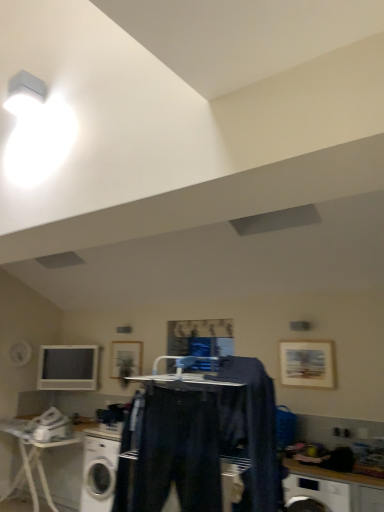
Question: From a real-world perspective, is white glossy washing machine at lower left located beneath dark blue fabric at center, the first clothing positioned from the right?

Choices:
 (A) yes
 (B) no

Answer: (A)

Question: Is white glossy washing machine at lower left further to the viewer compared to dark blue fabric at center, the second clothing from the left?

Choices:
 (A) yes
 (B) no

Answer: (A)

Question: Considering the relative sizes of white glossy washing machine at lower left and dark blue fabric at center, the second clothing from the left, in the image provided, is white glossy washing machine at lower left smaller than dark blue fabric at center, the second clothing from the left,?

Choices:
 (A) no
 (B) yes

Answer: (A)

Question: Is white glossy washing machine at lower left located outside dark blue fabric at center, the second clothing from the left?

Choices:
 (A) yes
 (B) no

Answer: (A)

Question: Is white glossy washing machine at lower left far away from dark blue fabric at center, the first clothing positioned from the right?

Choices:
 (A) no
 (B) yes

Answer: (A)

Question: Can you confirm if white glossy washing machine at lower left is positioned to the left of dark blue fabric at center, the second clothing from the left?

Choices:
 (A) no
 (B) yes

Answer: (B)

Question: Does white glossy computer monitor at left have a greater height compared to wooden framed picture at center, the second picture frame viewed from the right?

Choices:
 (A) no
 (B) yes

Answer: (B)

Question: Considering the relative sizes of white glossy computer monitor at left and wooden framed picture at center, which is counted as the second picture frame, starting from the front, in the image provided, is white glossy computer monitor at left smaller than wooden framed picture at center, which is counted as the second picture frame, starting from the front,?

Choices:
 (A) yes
 (B) no

Answer: (B)

Question: Could wooden framed picture at center, the 1th picture frame from the back, be considered to be inside white glossy computer monitor at left?

Choices:
 (A) no
 (B) yes

Answer: (A)

Question: Are white glossy computer monitor at left and wooden framed picture at center, which ranks as the first picture frame in left-to-right order, far apart?

Choices:
 (A) no
 (B) yes

Answer: (A)

Question: From the image's perspective, does white glossy computer monitor at left appear higher than wooden framed picture at center, the second picture frame viewed from the right?

Choices:
 (A) yes
 (B) no

Answer: (B)

Question: Is wooden framed picture at center, which ranks as the first picture frame in left-to-right order, at the back of white glossy computer monitor at left?

Choices:
 (A) yes
 (B) no

Answer: (B)

Question: From a real-world perspective, is white plastic table at lower left physically below wooden framed picture at center, which is counted as the second picture frame, starting from the front?

Choices:
 (A) yes
 (B) no

Answer: (A)